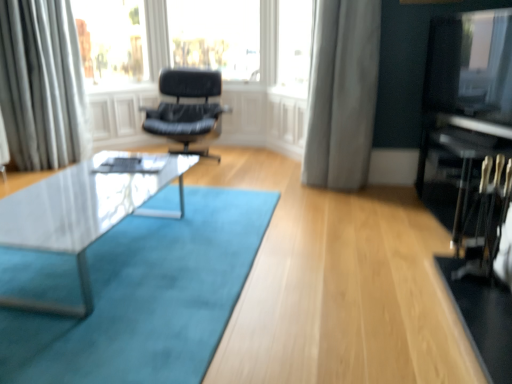
Measure the distance between gray fabric curtain at center, the first curtain from the right, and camera.

A distance of 9.31 feet exists between gray fabric curtain at center, the first curtain from the right, and camera.

What are the coordinates of `silky white curtain at upper left, which is counted as the 1th curtain, starting from the left` in the screenshot? It's located at (42, 85).

Which object is further away from the camera, clear glass window at upper center or black glossy entertainment center at right?

clear glass window at upper center is further away from the camera.

Is clear glass window at upper center with black glossy entertainment center at right?

There is a gap between clear glass window at upper center and black glossy entertainment center at right.

Does clear glass window at upper center have a greater width compared to black glossy entertainment center at right?

No.

The width and height of the screenshot is (512, 384). I want to click on window located above the black glossy entertainment center at right (from the image's perspective), so click(x=294, y=47).

How much distance is there between transparent glass at upper left and black glossy entertainment center at right?

transparent glass at upper left and black glossy entertainment center at right are 3.09 meters apart from each other.

Would you say transparent glass at upper left is a long distance from black glossy entertainment center at right?

transparent glass at upper left is positioned a significant distance from black glossy entertainment center at right.

Is transparent glass at upper left situated inside black glossy entertainment center at right or outside?

transparent glass at upper left is not inside black glossy entertainment center at right, it's outside.

Based on their positions, is black glossy entertainment center at right located to the left or right of clear glass window at upper center?

black glossy entertainment center at right is positioned on clear glass window at upper center's right side.

Is black glossy entertainment center at right in front of or behind clear glass window at upper center in the image?

Clearly, black glossy entertainment center at right is in front of clear glass window at upper center.

Does black glossy entertainment center at right have a larger size compared to clear glass window at upper center?

Correct, black glossy entertainment center at right is larger in size than clear glass window at upper center.

Is black glossy entertainment center at right not close to clear glass window at upper center?

Yes, black glossy entertainment center at right is far from clear glass window at upper center.

The image size is (512, 384). In order to click on the 2nd curtain above the black leather chair at center (from the image's perspective) in this screenshot , I will do `click(42, 85)`.

Is silky white curtain at upper left, the second curtain positioned from the right, oriented towards black leather chair at center?

No, silky white curtain at upper left, the second curtain positioned from the right, is not facing towards black leather chair at center.

Considering the positions of objects silky white curtain at upper left, the second curtain positioned from the right, and black leather chair at center in the image provided, who is more to the left, silky white curtain at upper left, the second curtain positioned from the right, or black leather chair at center?

silky white curtain at upper left, the second curtain positioned from the right, is more to the left.

From a real-world perspective, does silky white curtain at upper left, which is counted as the 1th curtain, starting from the left, stand above black leather chair at center?

Correct, in the physical world, silky white curtain at upper left, which is counted as the 1th curtain, starting from the left, is higher than black leather chair at center.

How distant is clear glass window at upper center from silky white curtain at upper left, which is counted as the 1th curtain, starting from the left?

clear glass window at upper center and silky white curtain at upper left, which is counted as the 1th curtain, starting from the left, are 2.10 meters apart.

Is clear glass window at upper center oriented towards silky white curtain at upper left, which is counted as the 1th curtain, starting from the left?

Yes, clear glass window at upper center faces towards silky white curtain at upper left, which is counted as the 1th curtain, starting from the left.

From the image's perspective, which object appears higher, clear glass window at upper center or silky white curtain at upper left, the second curtain positioned from the right?

clear glass window at upper center, from the image's perspective.

Which object is positioned more to the right, clear glass window at upper center or silky white curtain at upper left, which is counted as the 1th curtain, starting from the left?

clear glass window at upper center is more to the right.

Can you confirm if clear glass window at upper center is shorter than black leather chair at center?

No.

Is point (305, 37) positioned before point (173, 69)?

Yes, point (305, 37) is in front of point (173, 69).

Is clear glass window at upper center next to black leather chair at center and touching it?

No, clear glass window at upper center is not making contact with black leather chair at center.

What's the angular difference between clear glass window at upper center and black leather chair at center's facing directions?

There is a 59.8-degree angle between the facing directions of clear glass window at upper center and black leather chair at center.

Considering the sizes of objects black leather chair at center and white glossy coffee table at center in the image provided, who is smaller, black leather chair at center or white glossy coffee table at center?

With smaller size is white glossy coffee table at center.

How different are the orientations of black leather chair at center and white glossy coffee table at center in degrees?

They differ by 7.15 degrees in their facing directions.

Is white glossy coffee table at center located within black leather chair at center?

No.

Is black leather chair at center oriented towards white glossy coffee table at center?

Yes, black leather chair at center is oriented towards white glossy coffee table at center.

What are the coordinates of `entertainment center below the clear glass window at upper center (from the image's perspective)` in the screenshot? It's located at (466, 102).

Locate an element on the screen. entertainment center on the right of transparent glass at upper left is located at coordinates (466, 102).

Estimate the real-world distances between objects in this image. Which object is closer to transparent glass at upper left, black leather chair at center or silky white curtain at upper left, which is counted as the 1th curtain, starting from the left?

Based on the image, silky white curtain at upper left, which is counted as the 1th curtain, starting from the left, appears to be nearer to transparent glass at upper left.

Considering their positions, is silky white curtain at upper left, which is counted as the 1th curtain, starting from the left, positioned closer to black glossy entertainment center at right than white glossy coffee table at center?

white glossy coffee table at center is closer to black glossy entertainment center at right.

In the scene shown: When comparing their distances from black glossy entertainment center at right, does silky white curtain at upper left, the second curtain positioned from the right, or gray fabric curtain at center, the second curtain positioned from the left, seem further?

silky white curtain at upper left, the second curtain positioned from the right.

From the image, which object appears to be farther from clear glass window at upper center, black leather chair at center or black glossy entertainment center at right?

black glossy entertainment center at right is further to clear glass window at upper center.

In the scene shown: From the image, which object appears to be nearer to white glossy coffee table at center, transparent glass at upper left or silky white curtain at upper left, which is counted as the 1th curtain, starting from the left?

silky white curtain at upper left, which is counted as the 1th curtain, starting from the left, is positioned closer to the anchor white glossy coffee table at center.

Based on their spatial positions, is clear glass window at upper center or black leather chair at center further from gray fabric curtain at center, the first curtain from the right?

black leather chair at center is further to gray fabric curtain at center, the first curtain from the right.

Which object lies nearer to the anchor point black leather chair at center, clear glass window at upper center or transparent glass at upper left?

transparent glass at upper left is positioned closer to the anchor black leather chair at center.

When comparing their distances from black glossy entertainment center at right, does white glossy coffee table at center or clear glass window at upper center seem further?

The object further to black glossy entertainment center at right is white glossy coffee table at center.

At what (x,y) coordinates should I click in order to perform the action: click on bay window between silky white curtain at upper left, which is counted as the 1th curtain, starting from the left, and gray fabric curtain at center, the first curtain from the right, in the horizontal direction. Please return your answer as a coordinate pair (x, y). Looking at the image, I should click on (112, 41).

The image size is (512, 384). Identify the location of window between transparent glass at upper left and gray fabric curtain at center, the first curtain from the right, from left to right. (294, 47).

This screenshot has width=512, height=384. In order to click on coffee table between silky white curtain at upper left, the second curtain positioned from the right, and black glossy entertainment center at right from left to right in this screenshot , I will do `click(81, 215)`.

Where is `chair between white glossy coffee table at center and transparent glass at upper left in the front-back direction`? The image size is (512, 384). chair between white glossy coffee table at center and transparent glass at upper left in the front-back direction is located at coordinates (187, 109).